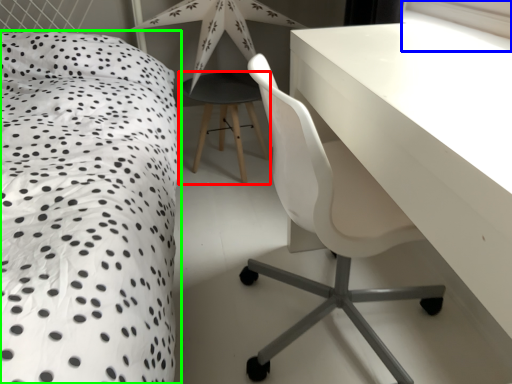
Question: Which object is the closest to the bar stool (highlighted by a red box)? Choose among these: window screen (highlighted by a blue box) or bed (highlighted by a green box).

Choices:
 (A) window screen
 (B) bed

Answer: (B)